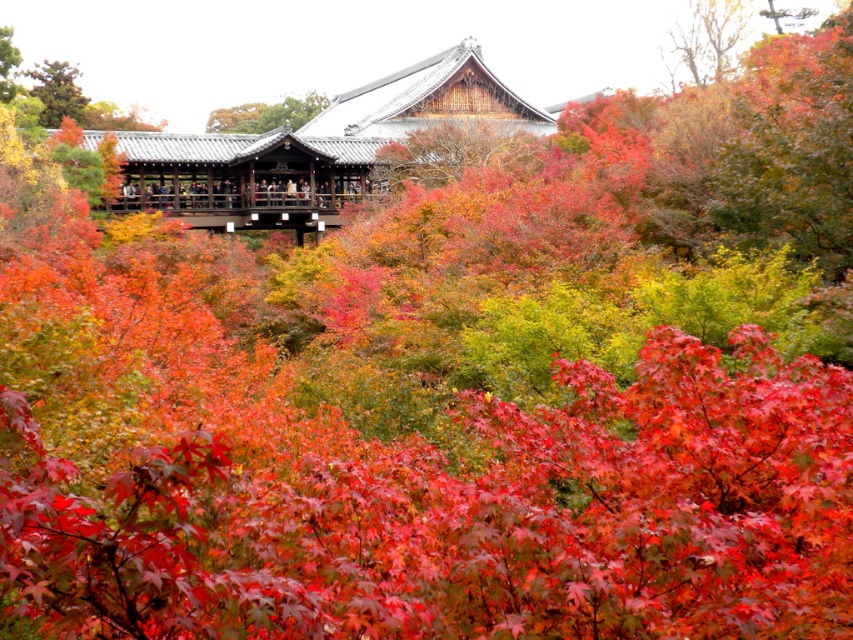
Does point (430, 177) come closer to viewer compared to point (28, 74)?

That is True.

The height and width of the screenshot is (640, 853). What are the coordinates of `smooth bark tree at center` in the screenshot? It's located at (445, 150).

What do you see at coordinates (445, 150) in the screenshot? This screenshot has width=853, height=640. I see `smooth bark tree at center` at bounding box center [445, 150].

At what (x,y) coordinates should I click in order to perform the action: click on smooth bark tree at center. Please return your answer as a coordinate pair (x, y). The height and width of the screenshot is (640, 853). Looking at the image, I should click on (445, 150).

Between smooth bark tree at center and smooth bark tree at upper right, which one appears on the right side from the viewer's perspective?

smooth bark tree at upper right

Is smooth bark tree at center taller than smooth bark tree at upper right?

Incorrect, smooth bark tree at center's height is not larger of smooth bark tree at upper right's.

What do you see at coordinates (445, 150) in the screenshot? The image size is (853, 640). I see `smooth bark tree at center` at bounding box center [445, 150].

Where is `smooth bark tree at center`? smooth bark tree at center is located at coordinates (445, 150).

Which is above, smooth bark tree at upper right or smooth brown tree trunk at upper center?

smooth brown tree trunk at upper center

Can you confirm if smooth bark tree at upper right is bigger than smooth brown tree trunk at upper center?

Indeed, smooth bark tree at upper right has a larger size compared to smooth brown tree trunk at upper center.

Does point (735, 4) come closer to viewer compared to point (219, 131)?

Yes, it is.

I want to click on smooth bark tree at upper right, so (709, 36).